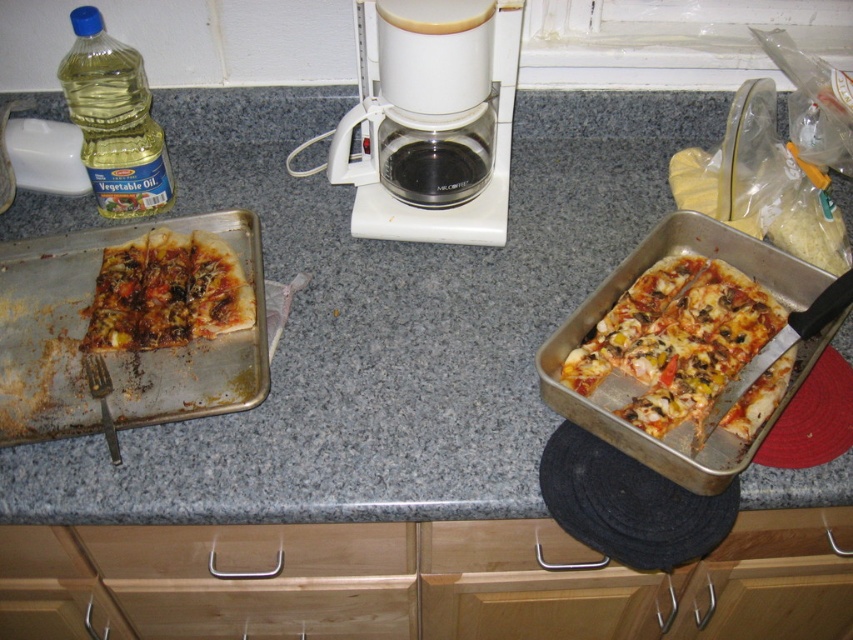
Who is positioned more to the right, cheesy pizza at right or translucent yellow vegetable oil at left?

cheesy pizza at right is more to the right.

Is cheesy pizza at right further to the viewer compared to translucent yellow vegetable oil at left?

No, cheesy pizza at right is in front of translucent yellow vegetable oil at left.

Between point (631, 406) and point (103, 157), which one is positioned in front?

Point (631, 406) is in front.

Locate an element on the screen. The width and height of the screenshot is (853, 640). cheesy pizza at right is located at coordinates (676, 339).

Is granite gray counter top at center positioned before wooden drawer at lower center?

Yes, granite gray counter top at center is closer to the viewer.

Who is more distant from viewer, (x=231, y=429) or (x=216, y=538)?

Point (x=216, y=538)

Who is more forward, (450, 408) or (91, 531)?

Point (450, 408) is more forward.

Image resolution: width=853 pixels, height=640 pixels. Identify the location of granite gray counter top at center. (381, 323).

Image resolution: width=853 pixels, height=640 pixels. In order to click on wooden drawer at lower center in this screenshot , I will do `click(248, 550)`.

In the scene shown: Measure the distance between wooden drawer at lower center and camera.

wooden drawer at lower center and camera are 30.73 inches apart.

Who is more forward, (263, 548) or (230, 308)?

Point (263, 548) is in front.

Find the location of a particular element. wooden drawer at lower center is located at coordinates (248, 550).